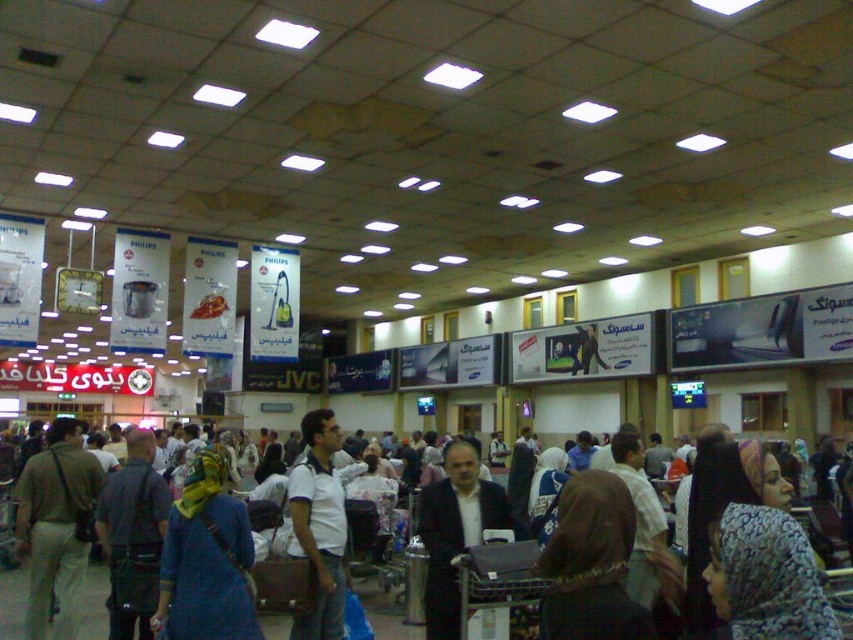
Can you confirm if light brown fabric backpack at left is wider than brown fabric crowd at center?

Correct, the width of light brown fabric backpack at left exceeds that of brown fabric crowd at center.

Does light brown fabric backpack at left appear on the left side of brown fabric crowd at center?

Correct, you'll find light brown fabric backpack at left to the left of brown fabric crowd at center.

Locate an element on the screen. The width and height of the screenshot is (853, 640). light brown fabric backpack at left is located at coordinates (56, 525).

Can you confirm if blue fabric headscarf at center is shorter than light brown fabric backpack at left?

Correct, blue fabric headscarf at center is not as tall as light brown fabric backpack at left.

Which is more to the right, blue fabric headscarf at center or light brown fabric backpack at left?

Positioned to the right is blue fabric headscarf at center.

Who is more distant from viewer, (x=218, y=525) or (x=39, y=624)?

The point (x=39, y=624) is more distant.

Locate an element on the screen. blue fabric headscarf at center is located at coordinates (206, 561).

Is blue fabric headscarf at center in front of brown fabric crowd at center?

Yes.

Who is taller, blue fabric headscarf at center or brown fabric crowd at center?

blue fabric headscarf at center is taller.

Who is more distant from viewer, [228,579] or [392,612]?

Point [392,612]

The height and width of the screenshot is (640, 853). What are the coordinates of `blue fabric headscarf at center` in the screenshot? It's located at (206, 561).